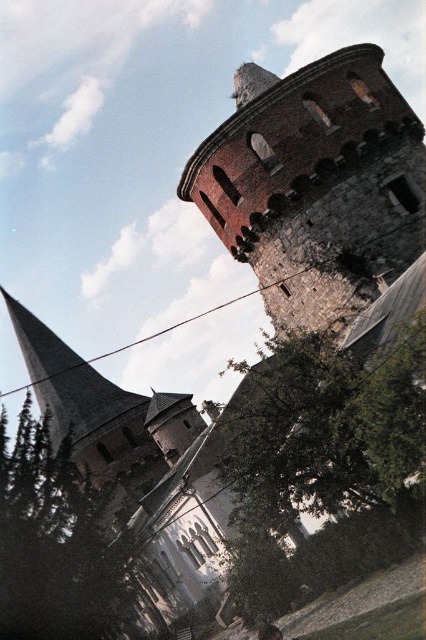
You are a drone operator trying to navigate between two points in the scene. You see the point at (244, 611) and the point at (22, 468). Which point is closer to the camera?

Point (22, 468) is closer to the camera because point (244, 611) is behind it.